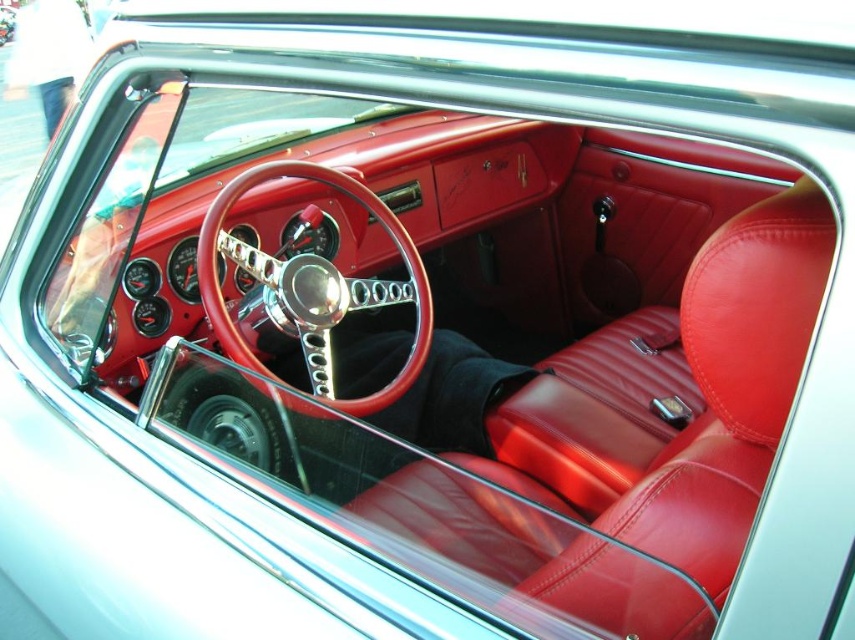
You are a mechanic working on a vintage car. You notice two wheels in the center of the car. Which one is closer to you, the shiny red leather steering wheel at center or the metallic silver wheel at center?

The shiny red leather steering wheel at center is closer to you because the metallic silver wheel at center is behind it.

You are sitting in the vintage car and want to reach a button located at point (246,349). There is another button at point (239,406). Which button is closer to you?

Point (239,406) is closer to you because point (246,349) is behind it.

You are a car mechanic working on this vintage car. You need to install a new gearshift lever between the shiny red leather steering wheel at center and the metallic silver wheel at center. The gearshift lever is 10 inches long. Will it fit between them?

The shiny red leather steering wheel at center and metallic silver wheel at center are 10.21 inches apart from each other. Since the gearshift lever is 10 inches long, it will fit between them with a small amount of space remaining.